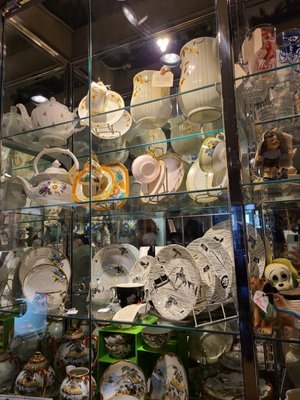
Identify the location of cups on top shelf. The height and width of the screenshot is (400, 300). (99, 94), (273, 44), (295, 37).